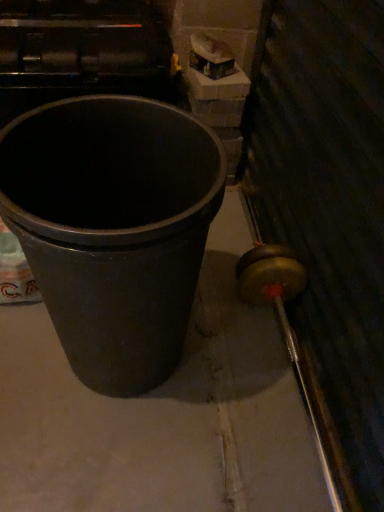
Question: Which is correct: matte black bucket at center-left is inside black plastic trash can at left, or outside of it?

Choices:
 (A) inside
 (B) outside

Answer: (B)

Question: Is matte black bucket at center-left wider or thinner than black plastic trash can at left?

Choices:
 (A) wide
 (B) thin

Answer: (A)

Question: From a real-world perspective, is matte black bucket at center-left physically located above or below black plastic trash can at left?

Choices:
 (A) below
 (B) above

Answer: (A)

Question: Is black plastic trash can at left bigger or smaller than matte black bucket at center-left?

Choices:
 (A) big
 (B) small

Answer: (A)

Question: From the image's perspective, is black plastic trash can at left located above or below matte black bucket at center-left?

Choices:
 (A) above
 (B) below

Answer: (A)

Question: Is black plastic trash can at left inside the boundaries of matte black bucket at center-left, or outside?

Choices:
 (A) outside
 (B) inside

Answer: (A)

Question: Is black plastic trash can at left wider or thinner than matte black bucket at center-left?

Choices:
 (A) thin
 (B) wide

Answer: (A)